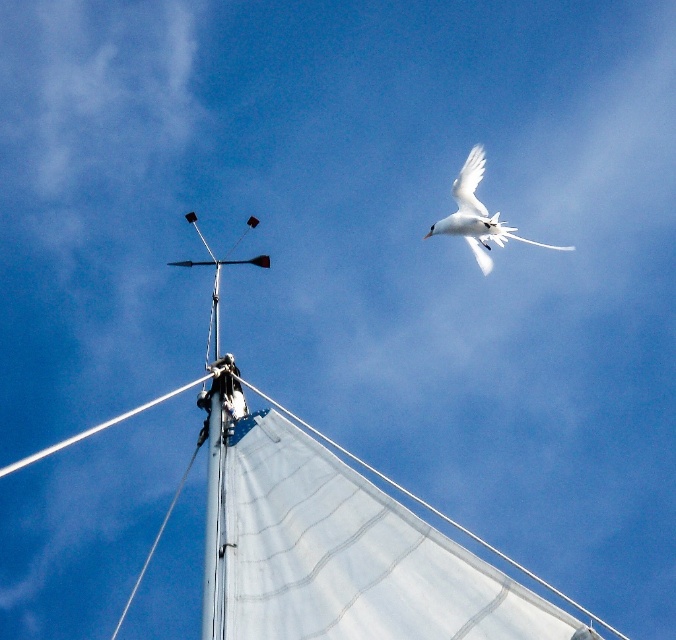
You are observing the sailboat mast and the two points in the image. Which of the two points, point (493, 611) or point (500, 236), is nearer to your viewpoint?

Point (493, 611) is closer to the camera than point (500, 236).

You are a birdwatcher observing the scene. You notice the white feathered bird at upper right and the white fabric sailboat at upper center. Which object is taller in the image?

The white fabric sailboat at upper center is much taller than the white feathered bird at upper right according to the description.

You are a photographer trying to capture both the white fabric sailboat at upper center and the white feathered bird at upper right in the same frame. Given their sizes, which object should you zoom in on to ensure both are visible without cropping?

Since the white fabric sailboat at upper center is larger than the white feathered bird at upper right, you should zoom out to ensure both are visible without cropping.